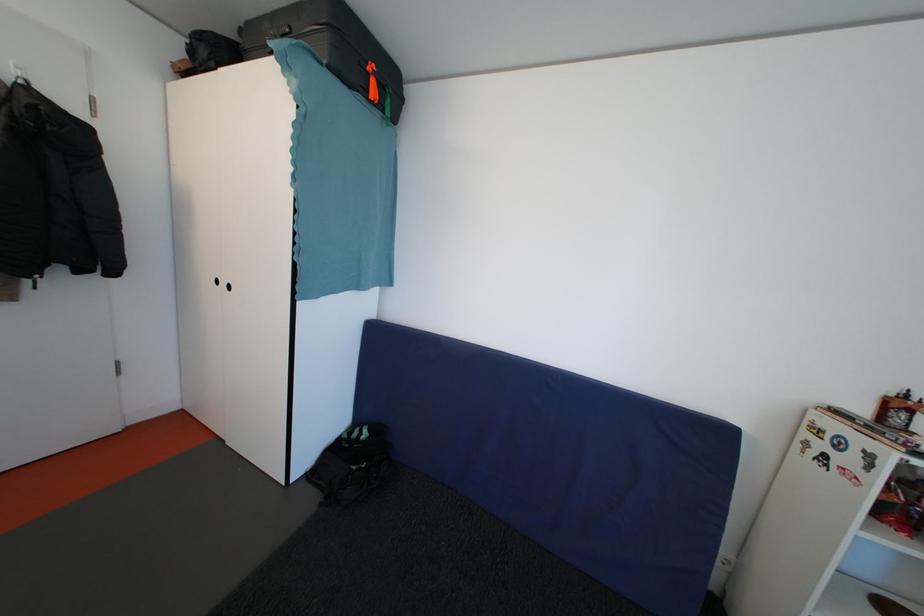
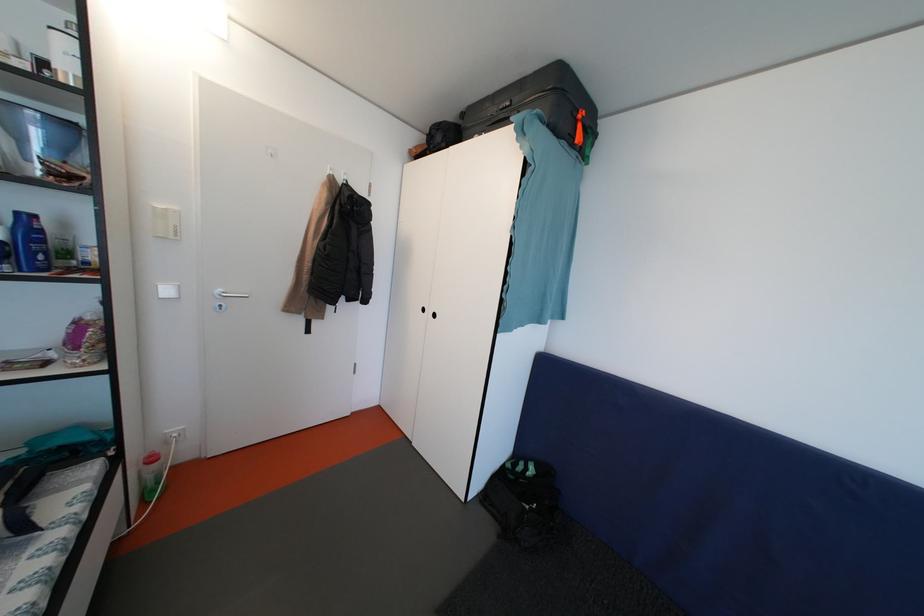
In the second image, find the point that corresponds to (368,439) in the first image.

(533, 474)